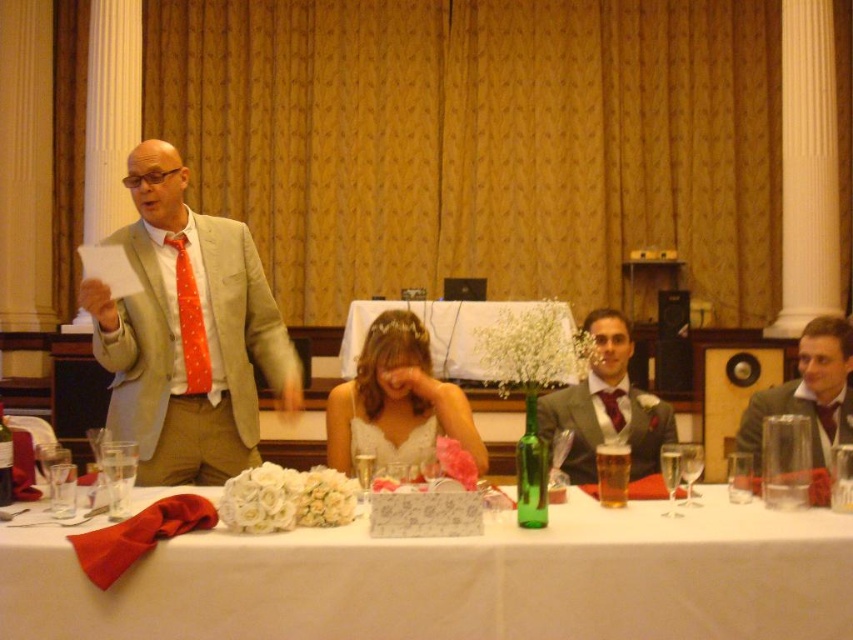
Question: Which object is closer to the camera taking this photo?

Choices:
 (A) white fabric table at center
 (B) matte gray suit at right
 (C) matte gray suit at center
 (D) matte beige suit at left

Answer: (A)

Question: Based on their relative distances, which object is farther from the matte beige suit at left?

Choices:
 (A) white fabric table at center
 (B) white satin dress at center

Answer: (A)

Question: Which point is closer to the camera?

Choices:
 (A) matte beige suit at left
 (B) white fabric table at center

Answer: (B)

Question: Does white satin tablecloth at center have a larger size compared to matte gray suit at right?

Choices:
 (A) no
 (B) yes

Answer: (B)

Question: Can you confirm if white satin dress at center is smaller than matte gray suit at right?

Choices:
 (A) yes
 (B) no

Answer: (A)

Question: Can you confirm if white fabric table at center is wider than matte gray suit at center?

Choices:
 (A) yes
 (B) no

Answer: (A)